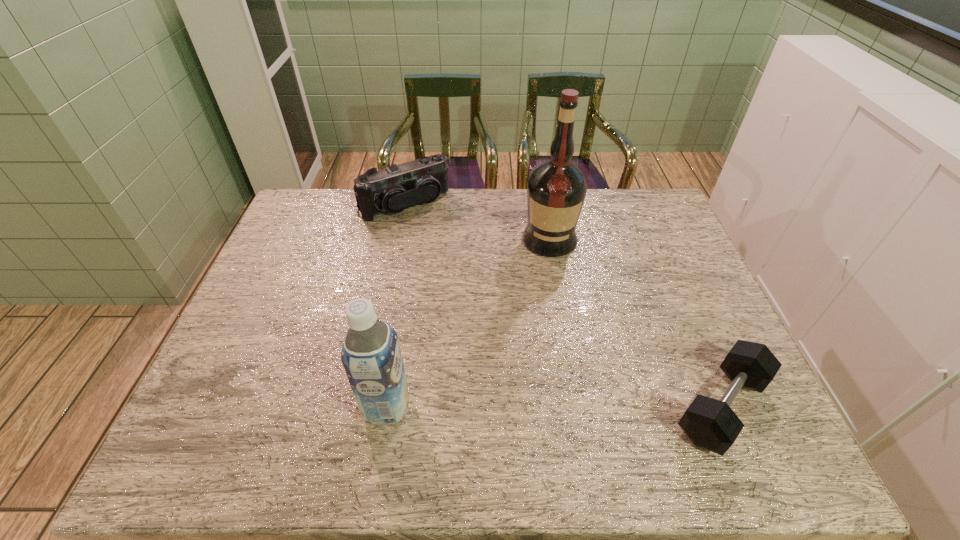
Identify the location of blank space located on the surface of the liquor. This screenshot has height=540, width=960. (545, 323).

At what (x,y) coordinates should I click in order to perform the action: click on free space located 0.160m on the surface of the liquor. Please return your answer as a coordinate pair (x, y). The image size is (960, 540). Looking at the image, I should click on (547, 296).

Find the location of `free spot located on the surface of the liquor`. free spot located on the surface of the liquor is located at coordinates (546, 312).

The width and height of the screenshot is (960, 540). In order to click on blank area located on the front-facing side of the second shortest object in this screenshot , I will do `click(475, 292)`.

You are a GUI agent. You are given a task and a screenshot of the screen. Output one action in this format:
    pyautogui.click(x=<x>, y=<y>)
    Task: Click on the free space located on the front-facing side of the second shortest object
    
    Given the screenshot: What is the action you would take?
    pyautogui.click(x=444, y=249)

You are a GUI agent. You are given a task and a screenshot of the screen. Output one action in this format:
    pyautogui.click(x=<x>, y=<y>)
    Task: Click on the vacant region located on the front-facing side of the second shortest object
    This screenshot has height=540, width=960.
    Given the screenshot: What is the action you would take?
    pyautogui.click(x=457, y=266)

Where is `liquor at the far edge`? liquor at the far edge is located at coordinates (556, 190).

This screenshot has width=960, height=540. I want to click on camcorder that is positioned at the far edge, so click(x=390, y=190).

You are a GUI agent. You are given a task and a screenshot of the screen. Output one action in this format:
    pyautogui.click(x=<x>, y=<y>)
    Task: Click on the soya milk that is at the near edge
    This screenshot has height=540, width=960.
    Given the screenshot: What is the action you would take?
    pyautogui.click(x=371, y=356)

Where is `dumbbell at the near edge`? dumbbell at the near edge is located at coordinates (711, 424).